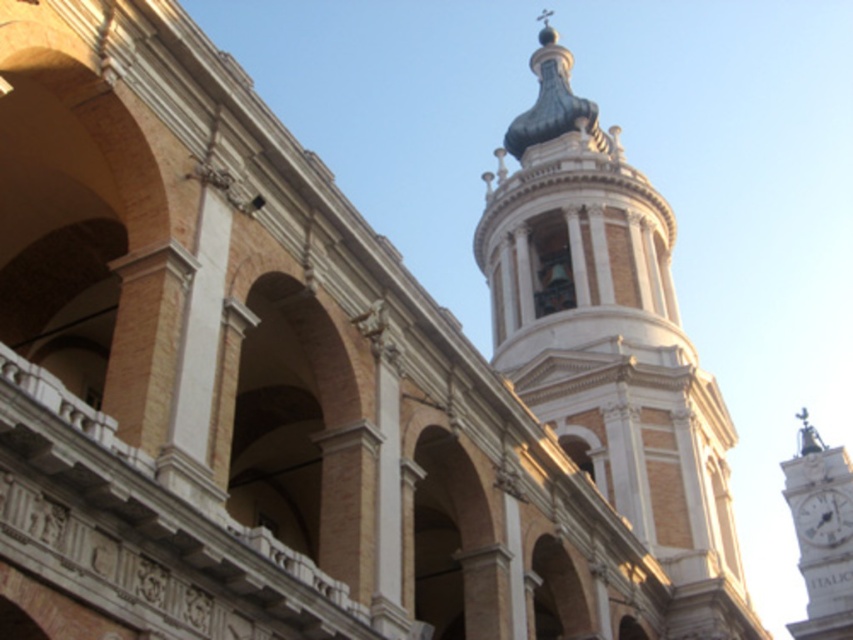
Based on the photo, is white marble bell tower at upper center bigger than white glossy clock at upper right?

Yes, white marble bell tower at upper center is bigger than white glossy clock at upper right.

What do you see at coordinates (611, 346) in the screenshot? The height and width of the screenshot is (640, 853). I see `white marble bell tower at upper center` at bounding box center [611, 346].

You are a GUI agent. You are given a task and a screenshot of the screen. Output one action in this format:
    pyautogui.click(x=<x>, y=<y>)
    Task: Click on the white marble bell tower at upper center
    The height and width of the screenshot is (640, 853).
    Given the screenshot: What is the action you would take?
    pyautogui.click(x=611, y=346)

Is white marble clock tower at right positioned in front of white glossy clock at upper right?

Yes, white marble clock tower at right is in front of white glossy clock at upper right.

From the picture: Who is shorter, white marble clock tower at right or white glossy clock at upper right?

white glossy clock at upper right is shorter.

At what (x,y) coordinates should I click in order to perform the action: click on white marble clock tower at right. Please return your answer as a coordinate pair (x, y). Looking at the image, I should click on (821, 532).

Is white marble bell tower at upper center to the right of white marble clock tower at right from the viewer's perspective?

Incorrect, white marble bell tower at upper center is not on the right side of white marble clock tower at right.

Can you confirm if white marble bell tower at upper center is shorter than white marble clock tower at right?

Result: No, white marble bell tower at upper center is not shorter than white marble clock tower at right.

Locate an element on the screen. white marble bell tower at upper center is located at coordinates (611, 346).